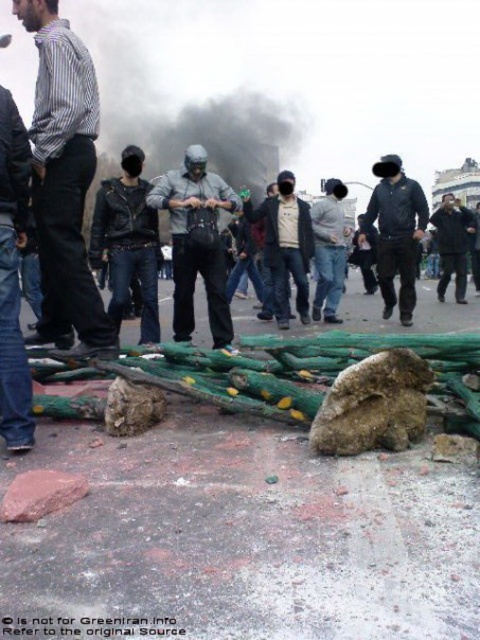
Question: Does gray matte helmet at center have a lesser width compared to dark blue jacket at center?

Choices:
 (A) yes
 (B) no

Answer: (B)

Question: Which object is closer to the camera taking this photo?

Choices:
 (A) gray matte helmet at center
 (B) dark blue jacket at center
 (C) denim jeans at left

Answer: (C)

Question: Is striped cotton shirt at left thinner than gray matte helmet at center?

Choices:
 (A) yes
 (B) no

Answer: (A)

Question: Which of the following is the closest to the observer?

Choices:
 (A) (433, 218)
 (B) (15, 356)

Answer: (B)

Question: Considering the real-world distances, which object is closest to the striped cotton shirt at left?

Choices:
 (A) denim jeans at left
 (B) gray matte helmet at center
 (C) dark blue jacket at center
 (D) dark gray jacket at center

Answer: (A)

Question: Can you confirm if gray matte helmet at center is wider than dark blue jacket at center?

Choices:
 (A) yes
 (B) no

Answer: (A)